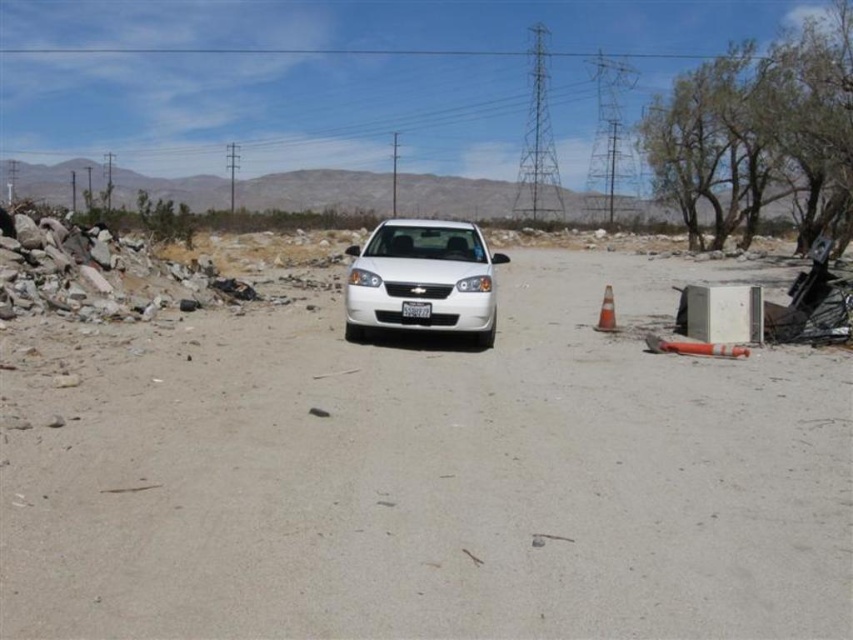
You are a delivery person who needs to park a delivery van that is 2 meters wide. You see the white glossy sedan at center and the white plastic license plate at center in the image. Can you determine if the space between the sedan and the license plate is wide enough for your van?

The white glossy sedan at center is wider than the white plastic license plate at center, so the space between them is not wide enough for a van that is 2 meters wide.

You are standing at the origin point of the coordinate system. You want to walk to the smooth sand at center. In which direction should you move?

The smooth sand at center is located at coordinate point (437, 477), so you should move towards the positive x and positive y direction from the origin point.

You are a delivery driver who needs to park your truck next to the white glossy sedan at center. However, there is a white plastic license plate at center blocking the space. Can you park your truck there?

The white glossy sedan at center is larger in size than the white plastic license plate at center, so the license plate is likely not blocking the parking space. You can park your truck there.